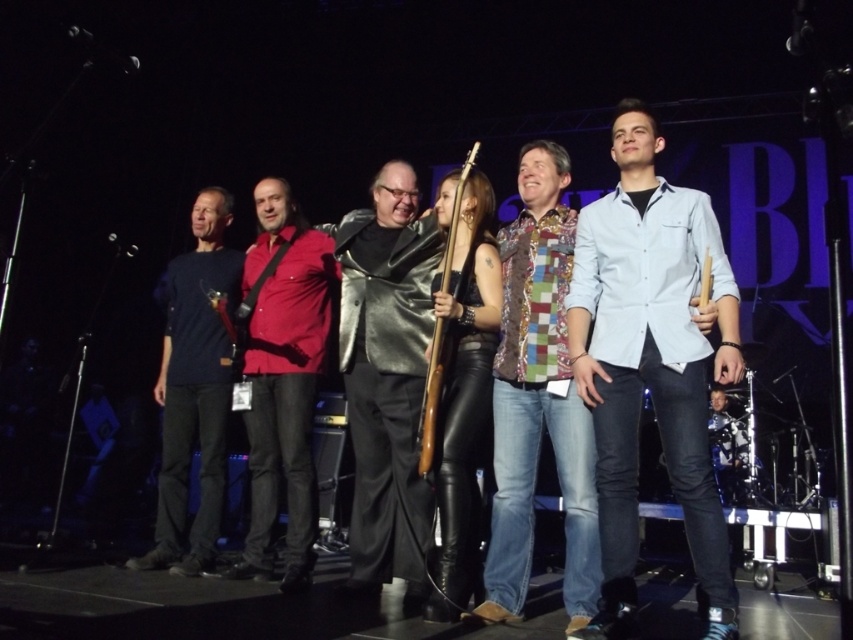
You are a photographer trying to capture a closeup of the shiny black guitar at center. You have a laser pointer to guide you. If you point your laser pointer at the point with coordinates (651, 394), will it land on the shiny black guitar at center?

Yes, the point (651, 394) is on the shiny black guitar at center, so the laser pointer will land on it.

You are a photographer adjusting your camera settings to focus on two specific points in the image. The first point is at coordinate point (590, 620) and the second is at coordinate point (207, 536). Which point should you focus on first to ensure proper depth of field?

Point (590, 620) is closer to the camera than point (207, 536), so focusing on point (590, 620) first will ensure proper depth of field.

You are a photographer positioned at the front of the stage. You need to take a photo that includes both the shiny black guitar at center and the light blue denim shirt at center. Which object should you focus on first to ensure both are in sharp focus?

You should focus on the shiny black guitar at center first because it is closer to you than the light blue denim shirt at center, ensuring both will be in focus when using a shallow depth of field.